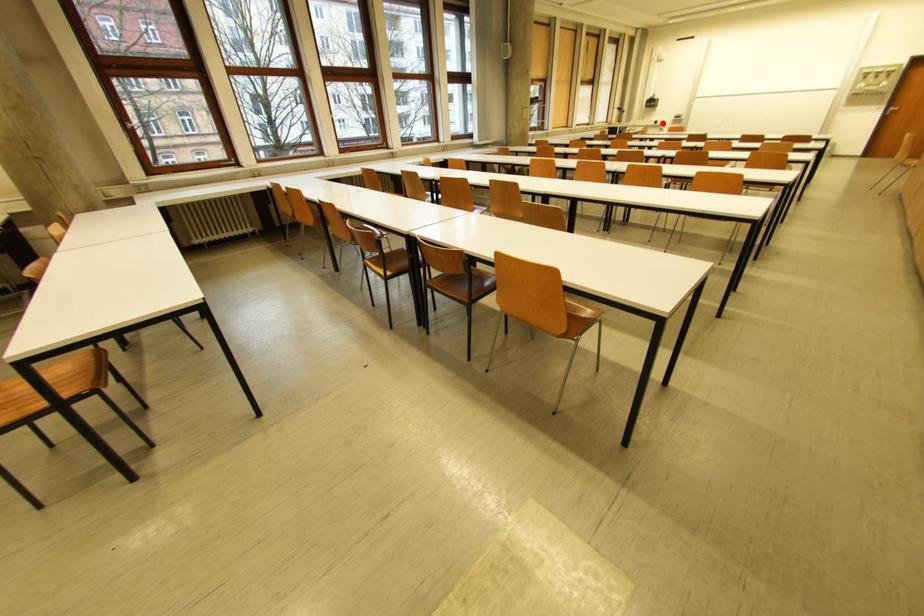
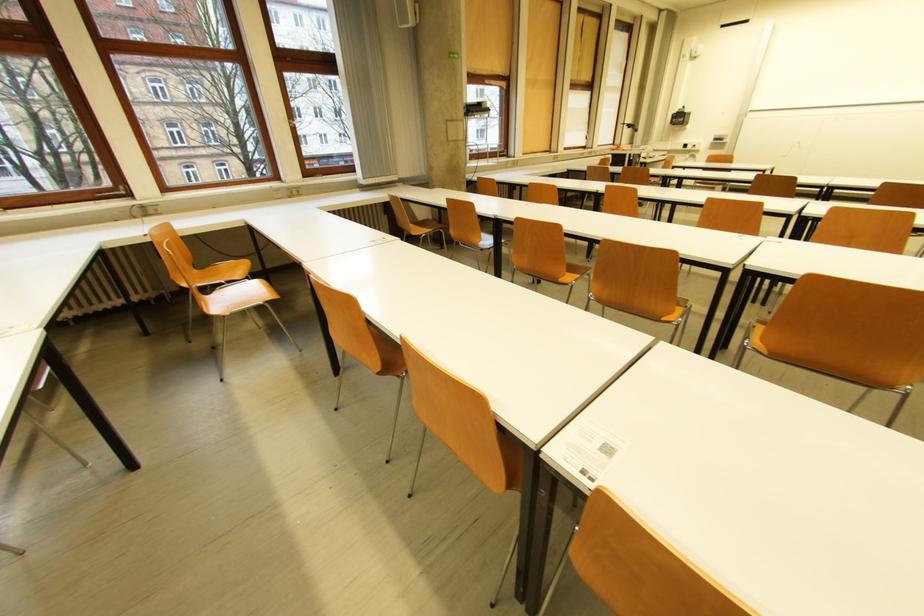
Find the pixel in the second image that matches the highlighted location in the first image.

(691, 147)